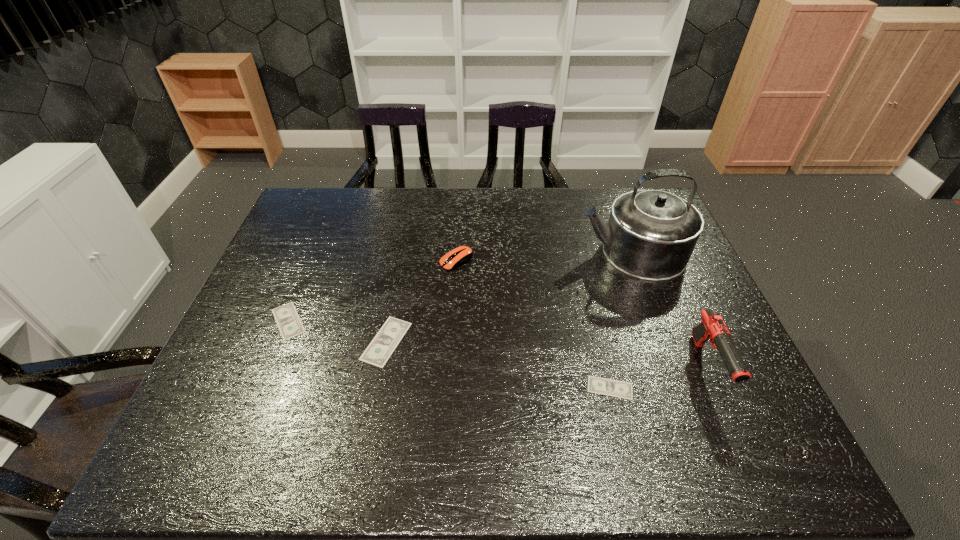
Locate an element on the screen. the leftmost object is located at coordinates (288, 321).

The height and width of the screenshot is (540, 960). Find the location of `the fifth tallest object`. the fifth tallest object is located at coordinates (288, 321).

At what (x,y) coordinates should I click in order to perform the action: click on the fourth tallest object. Please return your answer as a coordinate pair (x, y). The height and width of the screenshot is (540, 960). Looking at the image, I should click on (380, 349).

Locate an element on the screen. the second money from right to left is located at coordinates (380, 349).

Locate an element on the screen. The height and width of the screenshot is (540, 960). the shortest money is located at coordinates (614, 388).

Image resolution: width=960 pixels, height=540 pixels. I want to click on the rightmost money, so click(x=614, y=388).

Where is `computer mouse`? computer mouse is located at coordinates (461, 255).

Locate an element on the screen. The width and height of the screenshot is (960, 540). the third tallest object is located at coordinates (461, 255).

Where is `kettle`? The height and width of the screenshot is (540, 960). kettle is located at coordinates (651, 234).

The width and height of the screenshot is (960, 540). I want to click on gun, so click(x=712, y=328).